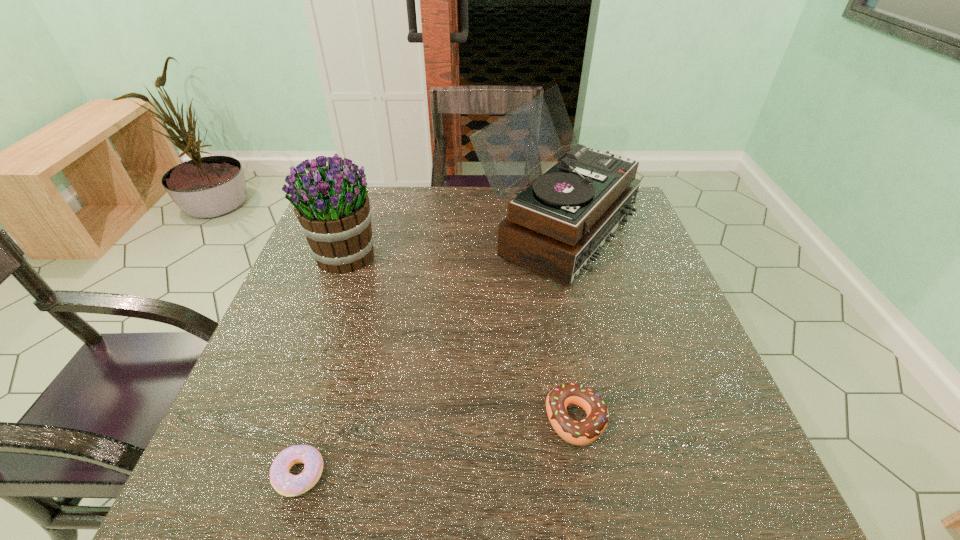
What are the coordinates of `free space at the right edge of the desktop` in the screenshot? It's located at 692,347.

Image resolution: width=960 pixels, height=540 pixels. What are the coordinates of `vacant area at the far right corner of the desktop` in the screenshot? It's located at (642, 222).

I want to click on free spot between the record player and the bouquet, so click(451, 243).

What are the coordinates of `free spot between the third shortest object and the nearer doughnut` in the screenshot? It's located at (323, 364).

Find the location of `free space that is in between the taller doughnut and the third shortest object`. free space that is in between the taller doughnut and the third shortest object is located at coordinates (461, 338).

This screenshot has width=960, height=540. Identify the location of vacant space in between the nearer doughnut and the third shortest object. (323, 364).

You are a GUI agent. You are given a task and a screenshot of the screen. Output one action in this format:
    pyautogui.click(x=<x>, y=<y>)
    Task: Click on the empty location between the nearer doughnut and the second tallest object
    This screenshot has width=960, height=540.
    Given the screenshot: What is the action you would take?
    pyautogui.click(x=323, y=364)

The width and height of the screenshot is (960, 540). I want to click on vacant space that's between the right doughnut and the shortest object, so click(438, 447).

Find the location of a particular element. The height and width of the screenshot is (540, 960). free space that is in between the bouquet and the record player is located at coordinates (451, 243).

Identify the location of blank region between the record player and the shorter doughnut. The image size is (960, 540). (427, 352).